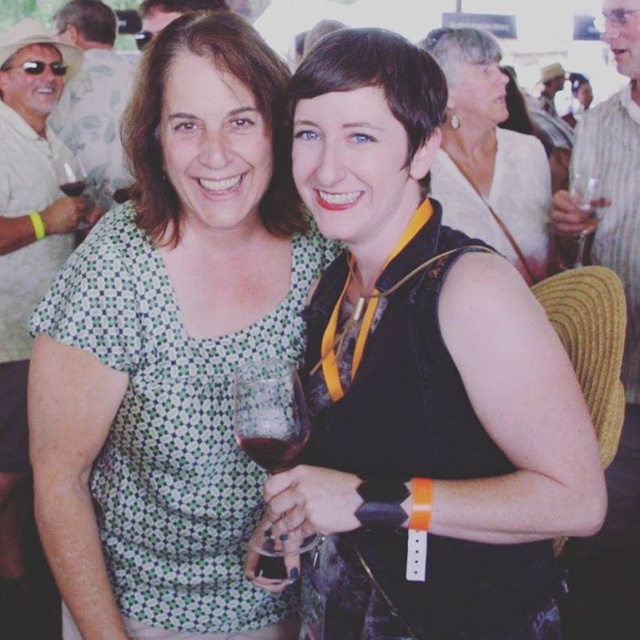
Please describe the position of the transparent glass at center in terms of coordinates within the image frame. The image frame is defined as a coordinate system where the bottom left corner is the origin point, and the top right corner is the point with the highest coordinates. The x and y values are normalized between 0 and 1. Please provide the coordinates as a tuple of two decimal numbers rounded to three decimal places.

The transparent glass at center is located at coordinates approximately equal to the point specified in the Objects Description, which is at point 0.647 in the x direction and 0.422 in the y direction.

You are a photographer at the event and want to capture the translucent glass at center and the clear glass wine glass at upper right in a single shot. Which glass will appear closer to the camera in the photo?

The clear glass wine glass at upper right appears closer to the camera because it is positioned above the translucent glass at center, which is beneath it.

You are at a social event and see the translucent glass at center. Where exactly is it located in terms of coordinates?

The translucent glass at center is located at point [273,451].